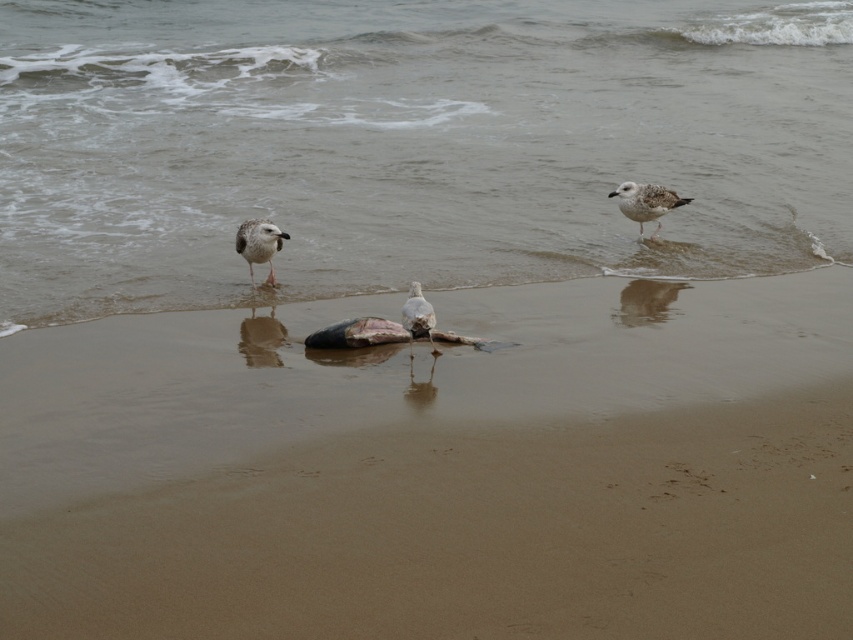
Question: Is white matte seagull at center above white feathered bird at center?

Choices:
 (A) no
 (B) yes

Answer: (B)

Question: Which is farther from the white feathered bird at upper right?

Choices:
 (A) smooth sand at center
 (B) white feathered bird at center
 (C) white matte seagull at center

Answer: (B)

Question: Is the position of smooth sand at center less distant than that of white feathered bird at upper right?

Choices:
 (A) yes
 (B) no

Answer: (A)

Question: Considering the real-world distances, which object is farthest from the white feathered bird at center?

Choices:
 (A) white feathered bird at upper right
 (B) white matte seagull at center
 (C) brown wet sand at lower center

Answer: (C)

Question: Which object is positioned closest to the brown wet sand at lower center?

Choices:
 (A) white feathered bird at upper right
 (B) white feathered bird at center
 (C) smooth sand at center
 (D) white matte seagull at center

Answer: (A)

Question: Where is brown wet sand at lower center located in relation to white feathered bird at upper right in the image?

Choices:
 (A) right
 (B) left

Answer: (B)